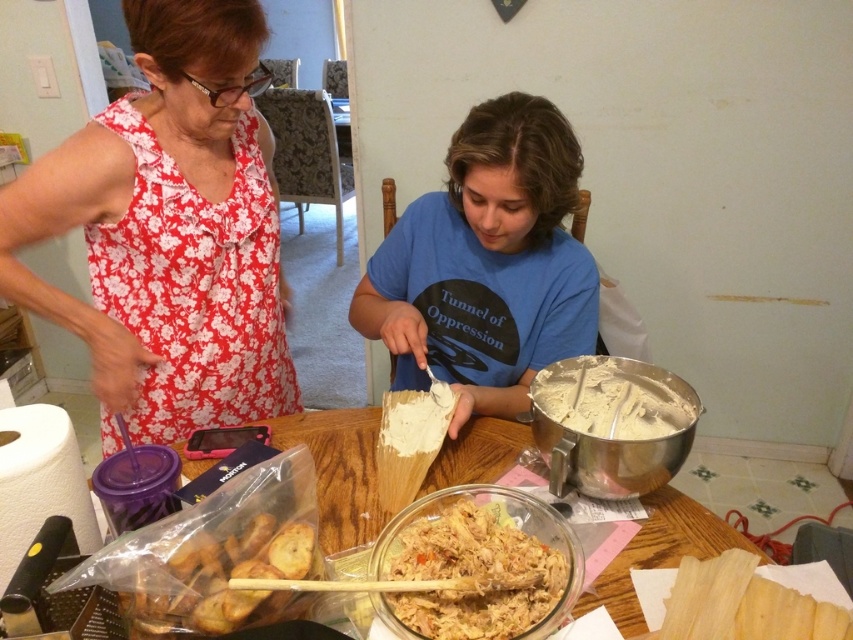
Does point (488, 209) come farther from viewer compared to point (263, 557)?

Yes, point (488, 209) is behind point (263, 557).

Does matte white paper at center appear over translucent plastic bag of breadsticks at lower left?

Yes.

Which is behind, point (412, 323) or point (258, 552)?

Positioned behind is point (412, 323).

Image resolution: width=853 pixels, height=640 pixels. Find the location of `matte white paper at center`. matte white paper at center is located at coordinates (486, 264).

Is translucent plastic bag at lower left to the right of translucent plastic bag of breadsticks at lower left from the viewer's perspective?

Yes, translucent plastic bag at lower left is to the right of translucent plastic bag of breadsticks at lower left.

Measure the distance between translucent plastic bag at lower left and translucent plastic bag of breadsticks at lower left.

translucent plastic bag at lower left and translucent plastic bag of breadsticks at lower left are 11.65 inches apart.

Describe the element at coordinates (338, 470) in the screenshot. I see `translucent plastic bag at lower left` at that location.

Image resolution: width=853 pixels, height=640 pixels. I want to click on translucent plastic bag at lower left, so pos(338,470).

The image size is (853, 640). I want to click on white shredded chicken at center, so (477, 564).

Which is below, white shredded chicken at center or translucent plastic bag of breadsticks at lower left?

white shredded chicken at center is lower down.

Between point (433, 531) and point (201, 612), which one is positioned in front?

Point (201, 612) is more forward.

Find the location of `white shredded chicken at center`. white shredded chicken at center is located at coordinates (477, 564).